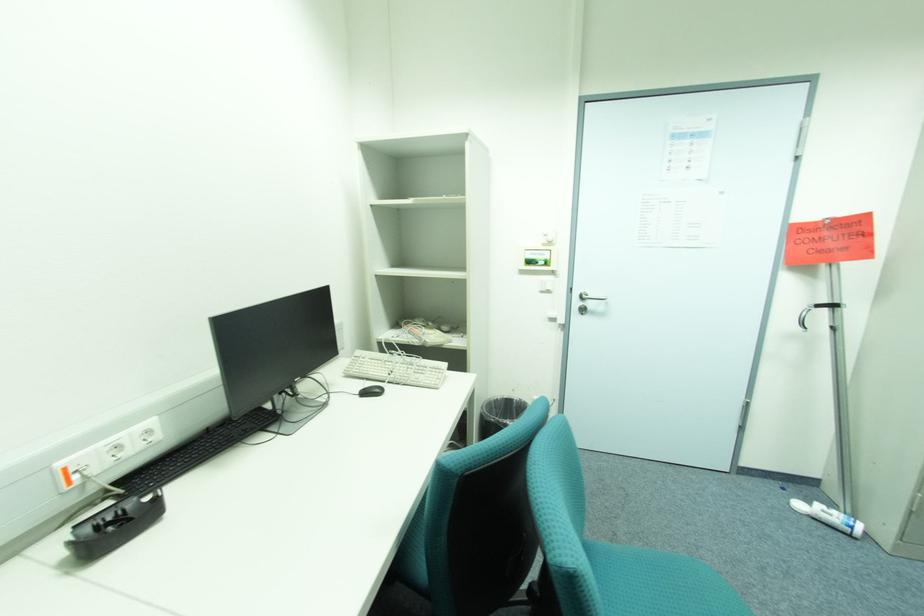
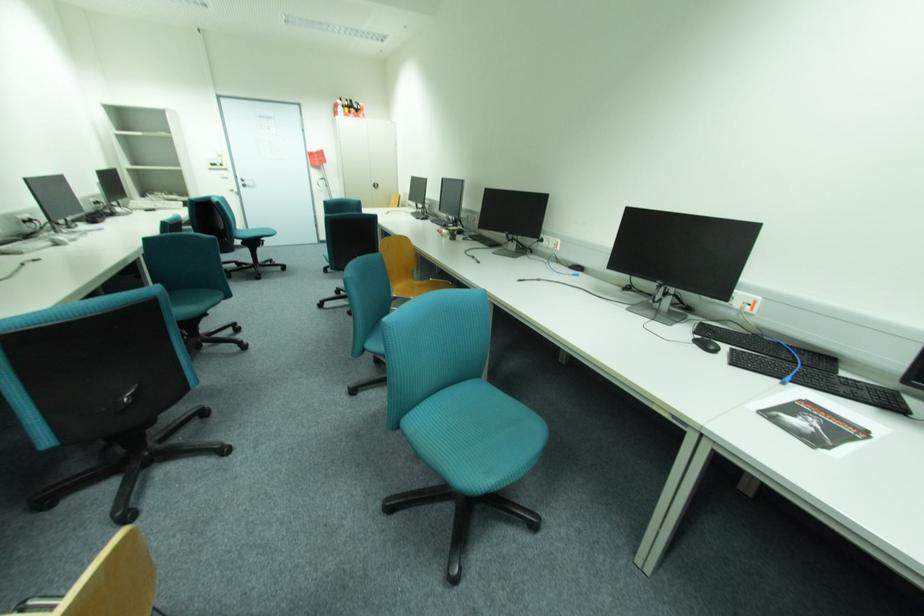
Locate, in the second image, the point that corresponds to point 596,305 in the first image.

(253, 183)